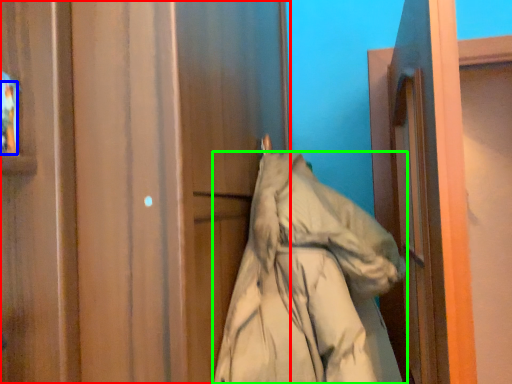
Question: Which object is the farthest from door (highlighted by a red box)? Choose among these: person (highlighted by a blue box) or coat (highlighted by a green box).

Choices:
 (A) person
 (B) coat

Answer: (A)